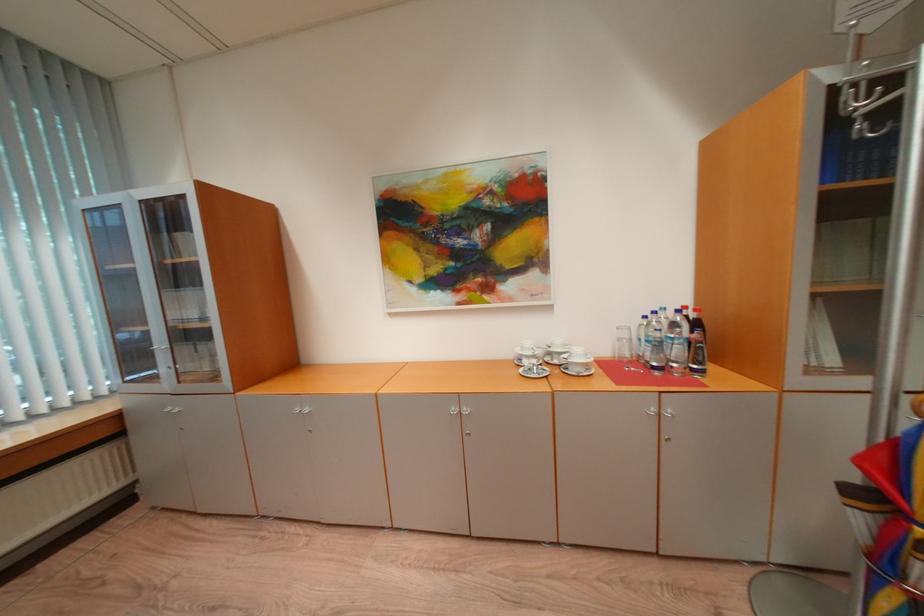
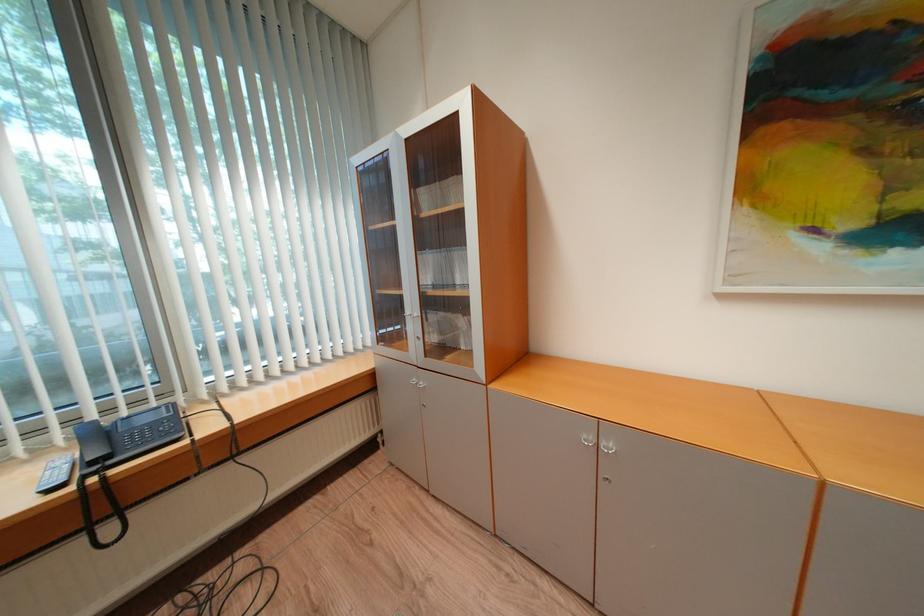
Question: The first image is from the beginning of the video and the second image is from the end. How did the camera likely rotate when shooting the video?

Choices:
 (A) Left
 (B) Right
 (C) Up
 (D) Down

Answer: (A)